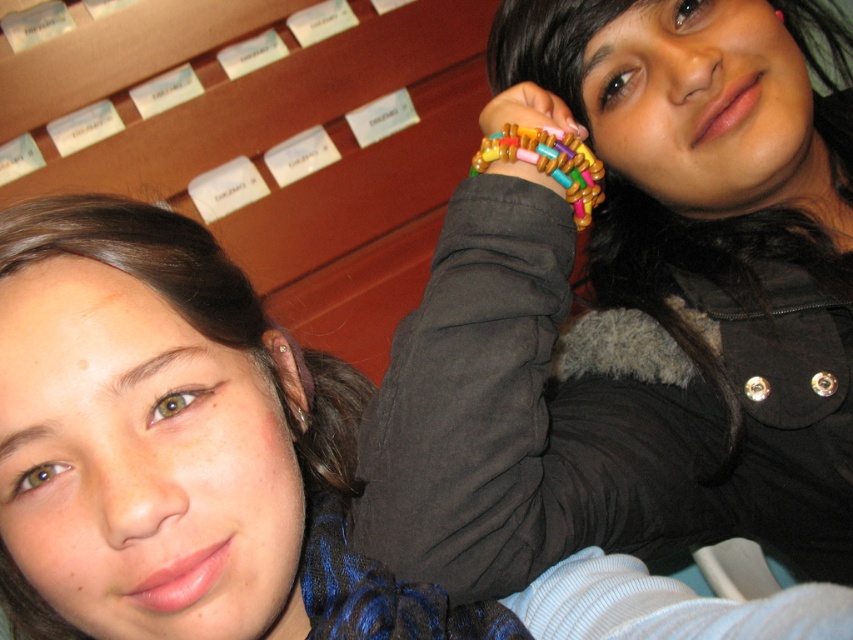
You are a photographer trying to capture a closeup of the beaded bracelet at center without including the matte black jacket at upper right in the frame. Is this possible given their positions?

The matte black jacket at upper right might be wider than beaded bracelet at center, so it might block the view of the beaded bracelet at center depending on the camera angle and distance. Adjust your position to ensure the jacket is out of frame.

You are a photographer trying to capture a candid shot of the beaded bracelet at center and the matte black jacket at upper right. Since you want to ensure both are in the frame, can you determine which object is positioned to the left of the other?

The matte black jacket at upper right is to the left of beaded bracelet at center, so to include both in the frame, position your camera so that the matte black jacket at upper right is on the left side and the beaded bracelet at center is on the right side.

You are a photographer trying to capture a closeup of the wooden beads at upper center without including the matte black jacket at upper right in the frame. Given their spatial relationship, is this possible?

The matte black jacket at upper right is wider than the wooden beads at upper center, so it might be challenging to capture the beads without the jacket appearing in the frame, depending on the camera angle and zoom level.